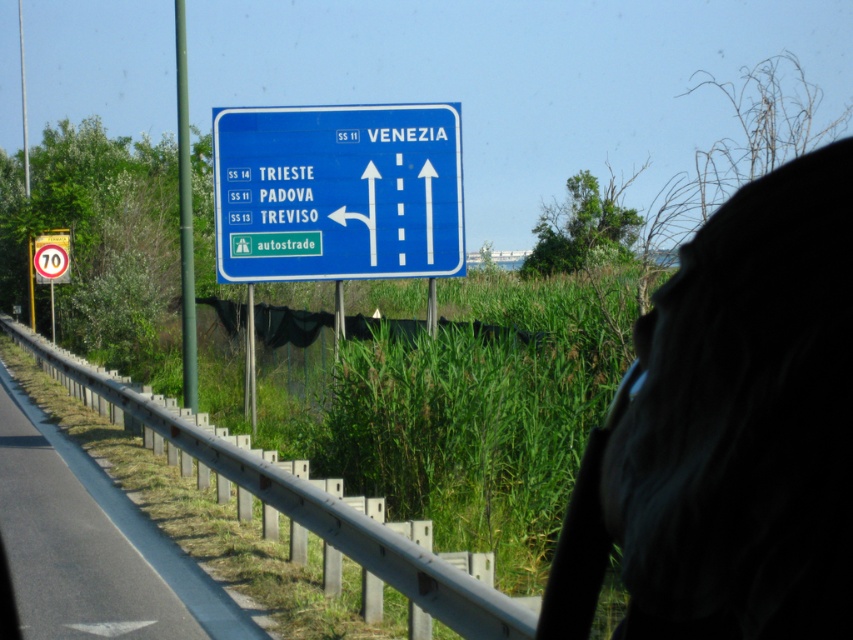
You are driving and see the blue plastic sign at upper center and the metallic gray guardrail at lower left. Which object is positioned higher in the image?

The blue plastic sign at upper center is located above the metallic gray guardrail at lower left, so it is positioned higher in the image.